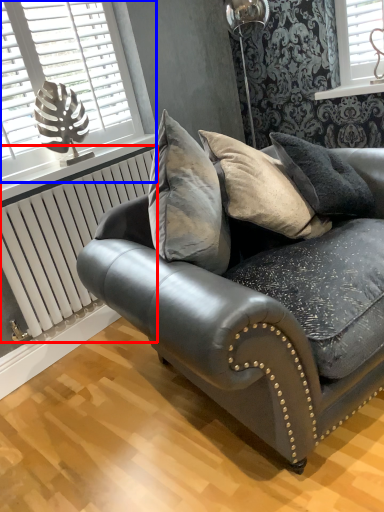
Question: Which point is closer to the camera, radiator (highlighted by a red box) or window (highlighted by a blue box)?

Choices:
 (A) radiator
 (B) window

Answer: (B)